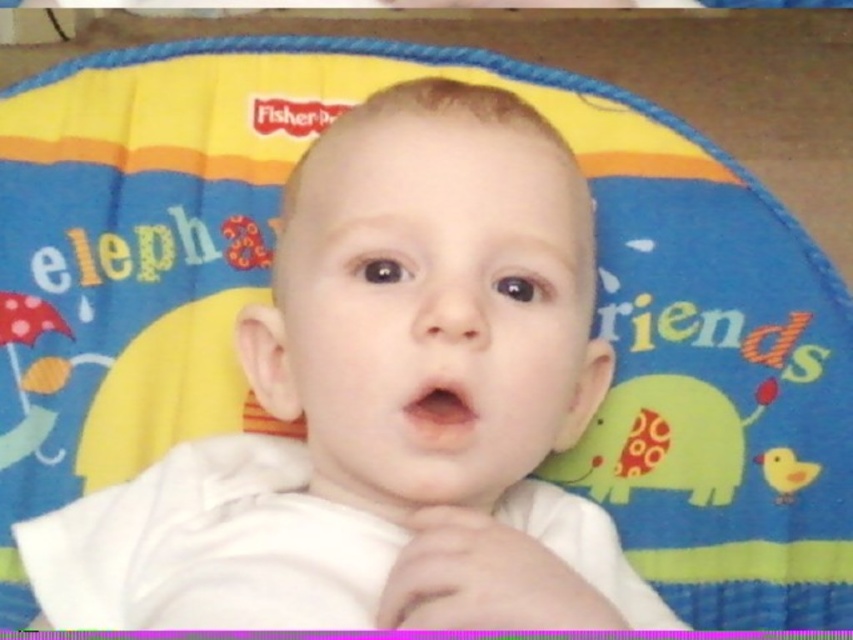
Question: Which point is closer to the camera taking this photo?

Choices:
 (A) (413, 154)
 (B) (811, 461)

Answer: (A)

Question: In this image, where is white soft baby at center located relative to yellow matte duckling at lower right?

Choices:
 (A) above
 (B) below

Answer: (A)

Question: From the image, what is the correct spatial relationship of white soft baby at center in relation to yellow matte duckling at lower right?

Choices:
 (A) below
 (B) above

Answer: (B)

Question: Does white soft baby at center have a larger size compared to yellow matte duckling at lower right?

Choices:
 (A) yes
 (B) no

Answer: (A)

Question: Which of the following is the closest to the observer?

Choices:
 (A) yellow matte duckling at lower right
 (B) white soft baby at center

Answer: (B)